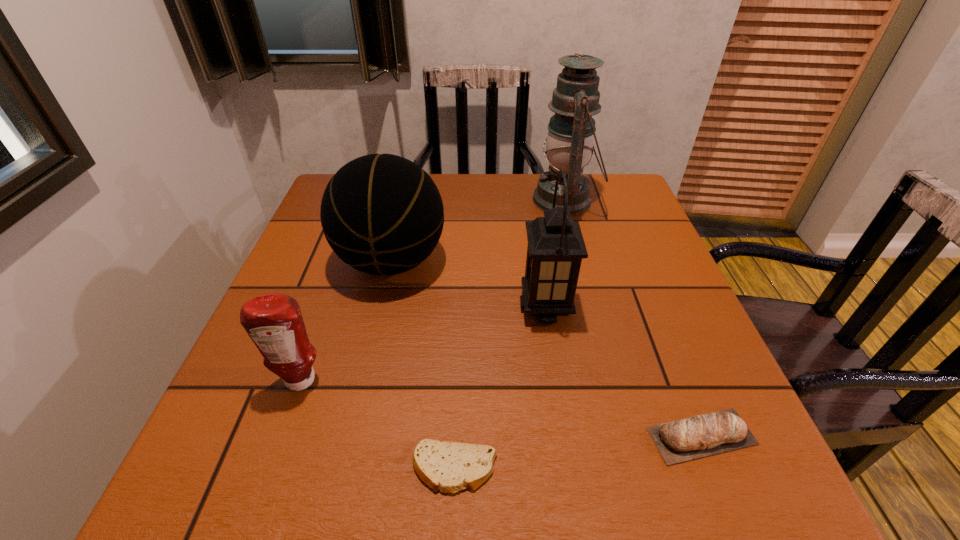
Locate an element on the screen. This screenshot has height=540, width=960. free space that is in between the fourth farthest object and the shortest object is located at coordinates (377, 424).

Where is `free space that is in between the second tallest object and the fourth tallest object`? This screenshot has height=540, width=960. free space that is in between the second tallest object and the fourth tallest object is located at coordinates (423, 344).

Identify the location of free spot between the condiment and the taller pita bread. Image resolution: width=960 pixels, height=540 pixels. (501, 408).

The image size is (960, 540). I want to click on empty space that is in between the tallest object and the third tallest object, so click(478, 231).

Locate an element on the screen. free spot between the shorter pita bread and the lantern is located at coordinates (500, 388).

Where is `free spot between the right pita bread and the tallest object`? The width and height of the screenshot is (960, 540). free spot between the right pita bread and the tallest object is located at coordinates (634, 318).

You are a GUI agent. You are given a task and a screenshot of the screen. Output one action in this format:
    pyautogui.click(x=<x>, y=<y>)
    Task: Click on the unoccupied area between the shortest object and the oil lamp
    
    Given the screenshot: What is the action you would take?
    pyautogui.click(x=510, y=334)

At what (x,y) coordinates should I click in order to perform the action: click on empty location between the condiment and the oil lamp. Please return your answer as a coordinate pair (x, y). The image size is (960, 540). Looking at the image, I should click on (433, 290).

Where is `object that is the fourth closest to the lantern`? object that is the fourth closest to the lantern is located at coordinates (449, 467).

Locate an element on the screen. the third closest object to the third nearest object is located at coordinates (556, 247).